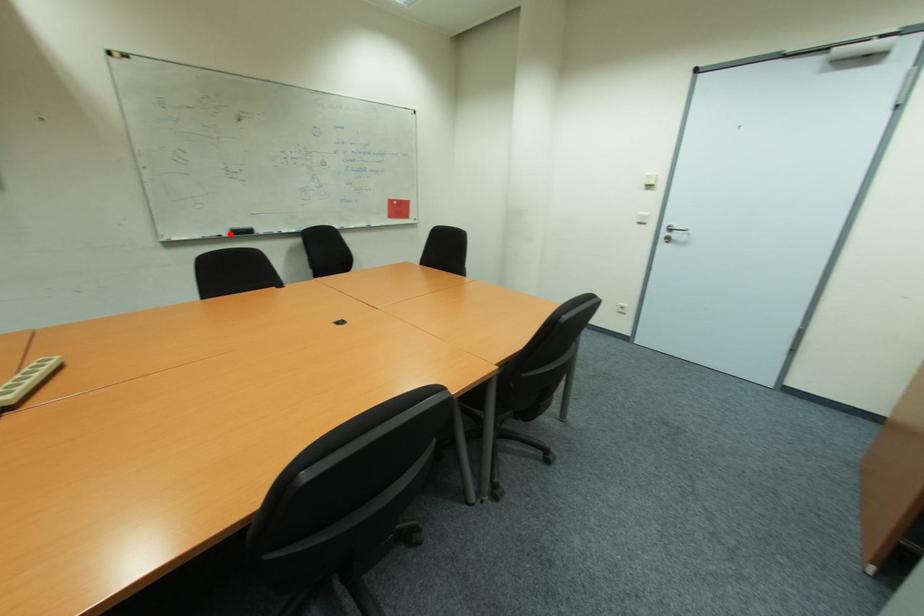
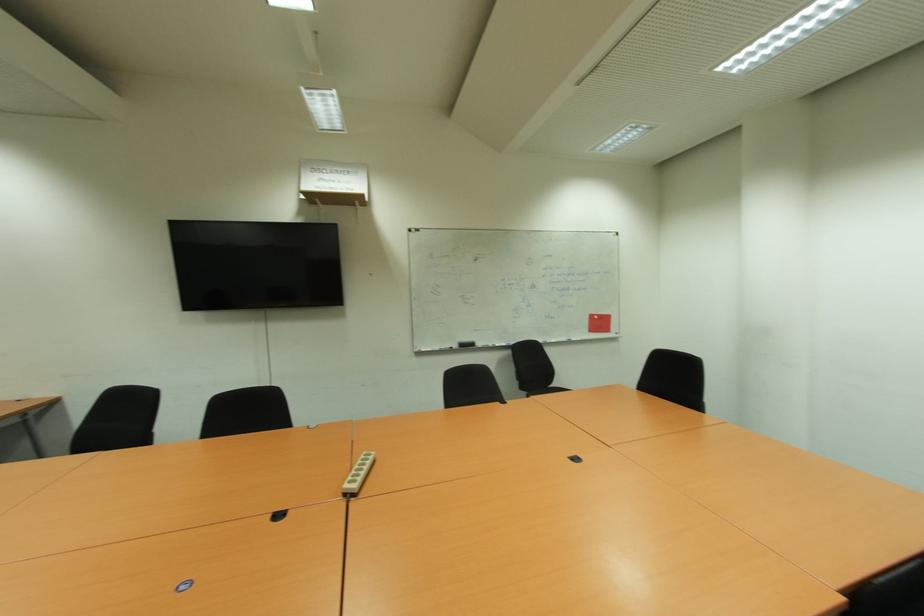
In the second image, find the point that corresponds to the highlighted location in the first image.

(457, 347)